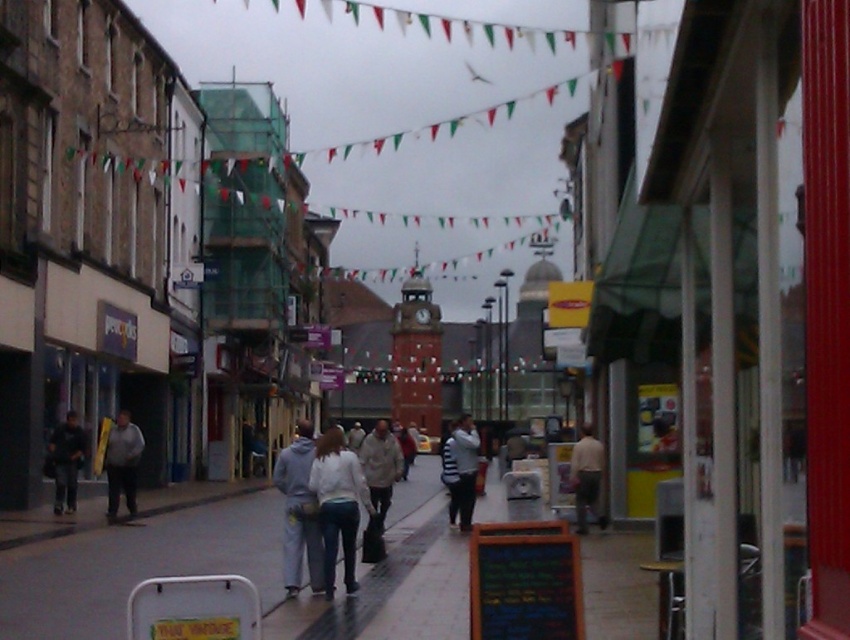
Does black chalkboard at lower right appear on the left side of dark gray hoodie at left?

In fact, black chalkboard at lower right is to the right of dark gray hoodie at left.

Is black chalkboard at lower right bigger than dark gray hoodie at left?

No.

Where is `black chalkboard at lower right`? This screenshot has width=850, height=640. black chalkboard at lower right is located at coordinates (524, 580).

Is dark gray hoodie at left thinner than light beige fabric jacket at center?

In fact, dark gray hoodie at left might be wider than light beige fabric jacket at center.

Between dark gray hoodie at left and light beige fabric jacket at center, which one is positioned higher?

dark gray hoodie at left is above.

Who is more distant from viewer, (x=66, y=508) or (x=595, y=476)?

The point (x=66, y=508) is behind.

The height and width of the screenshot is (640, 850). I want to click on dark gray hoodie at left, so click(x=66, y=461).

Who is shorter, white matte jacket at center or gray hoodie at center?

With less height is gray hoodie at center.

Can you confirm if white matte jacket at center is wider than gray hoodie at center?

Incorrect, white matte jacket at center's width does not surpass gray hoodie at center's.

Which is in front, point (315, 492) or point (273, 481)?

Point (315, 492)

This screenshot has width=850, height=640. Identify the location of white matte jacket at center. (338, 504).